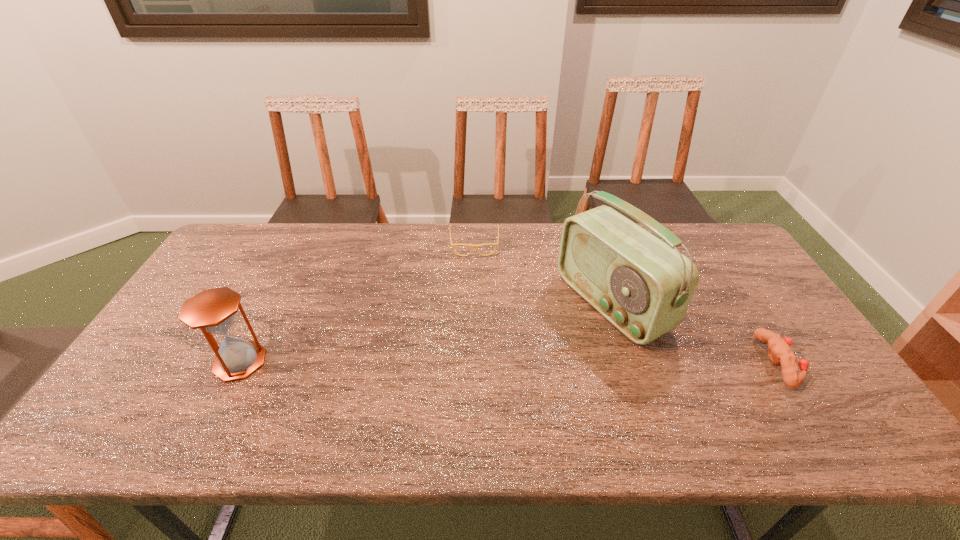
Locate an element on the screen. The height and width of the screenshot is (540, 960). vacant spot on the desktop that is between the leftmost object and the puncher and is positioned in front of the lenses of the spectacles is located at coordinates (476, 362).

Locate an element on the screen. The image size is (960, 540). vacant spot on the desktop that is between the hourglass and the second shortest object and is positioned on the front panel of the second object from right to left is located at coordinates (491, 362).